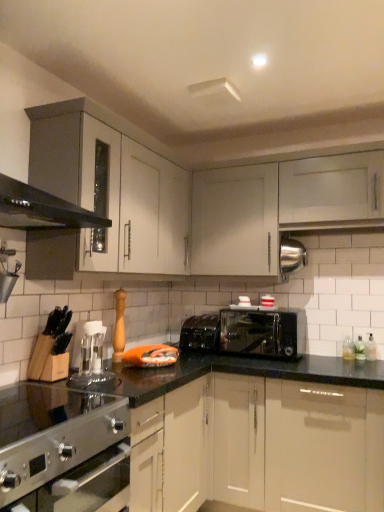
Question: Does white matte cabinet at upper center, the first cabinetry from the left, have a greater width compared to transparent plastic coffee machine at center?

Choices:
 (A) yes
 (B) no

Answer: (A)

Question: From a real-world perspective, is white matte cabinet at upper center, the first cabinetry from the left, physically above transparent plastic coffee machine at center?

Choices:
 (A) yes
 (B) no

Answer: (A)

Question: Does white matte cabinet at upper center, the first cabinetry from the left, turn towards transparent plastic coffee machine at center?

Choices:
 (A) yes
 (B) no

Answer: (B)

Question: Is the position of white matte cabinet at upper center, the second cabinetry when ordered from right to left, less distant than that of transparent plastic coffee machine at center?

Choices:
 (A) no
 (B) yes

Answer: (A)

Question: Can you confirm if white matte cabinet at upper center, the first cabinetry from the left, is positioned to the right of transparent plastic coffee machine at center?

Choices:
 (A) no
 (B) yes

Answer: (B)

Question: Is white matte cabinet at upper center, the first cabinetry from the left, outside transparent plastic coffee machine at center?

Choices:
 (A) yes
 (B) no

Answer: (A)

Question: Are white matte cabinet at upper center, the second cabinetry when ordered from right to left, and satin silver gas stove at lower left beside each other?

Choices:
 (A) no
 (B) yes

Answer: (A)

Question: Does white matte cabinet at upper center, the first cabinetry from the left, lie behind satin silver gas stove at lower left?

Choices:
 (A) no
 (B) yes

Answer: (B)

Question: From the image's perspective, is white matte cabinet at upper center, the second cabinetry when ordered from right to left, located beneath satin silver gas stove at lower left?

Choices:
 (A) yes
 (B) no

Answer: (B)

Question: Does white matte cabinet at upper center, the first cabinetry from the left, have a greater width compared to satin silver gas stove at lower left?

Choices:
 (A) no
 (B) yes

Answer: (A)

Question: Is white matte cabinet at upper center, the second cabinetry when ordered from right to left, oriented towards satin silver gas stove at lower left?

Choices:
 (A) yes
 (B) no

Answer: (A)

Question: Considering the relative sizes of white matte cabinet at upper center, the second cabinetry when ordered from right to left, and satin silver gas stove at lower left in the image provided, is white matte cabinet at upper center, the second cabinetry when ordered from right to left, shorter than satin silver gas stove at lower left?

Choices:
 (A) no
 (B) yes

Answer: (A)

Question: Is satin silver gas stove at lower left oriented away from transparent plastic coffee machine at center?

Choices:
 (A) yes
 (B) no

Answer: (B)